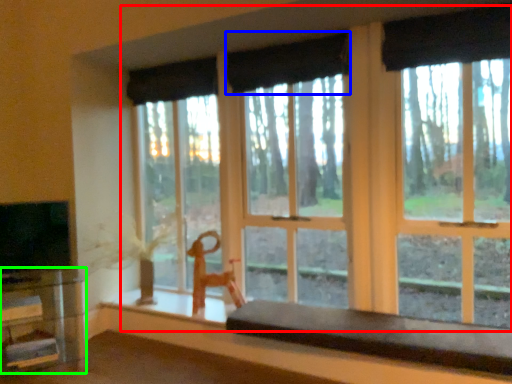
Question: Which object is positioned farthest from window (highlighted by a red box)? Select from curtain (highlighted by a blue box) and table (highlighted by a green box).

Choices:
 (A) curtain
 (B) table

Answer: (B)